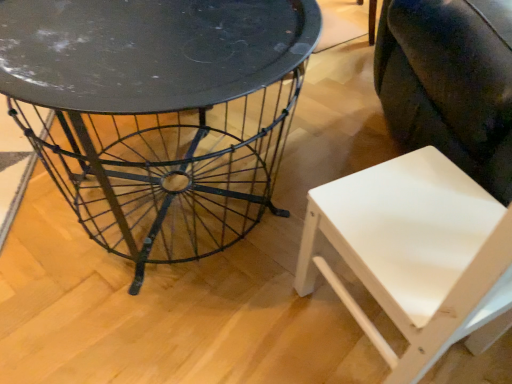
The image size is (512, 384). Identify the location of free space below metallic wire table at center (from a real-world perspective). (163, 205).